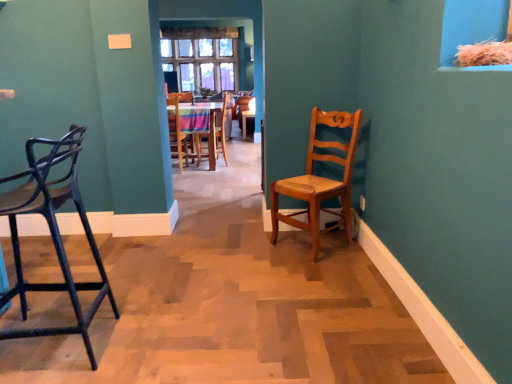
Question: Is the surface of light brown wooden chair at center, which is counted as the 2th chair, starting from the front, in direct contact with wooden chair at center, the 4th chair from the front?

Choices:
 (A) no
 (B) yes

Answer: (A)

Question: From the image's perspective, is light brown wooden chair at center, which ranks as the fourth chair in back-to-front order, located beneath wooden chair at center, the 4th chair from the front?

Choices:
 (A) no
 (B) yes

Answer: (B)

Question: Is light brown wooden chair at center, which is counted as the 2th chair, starting from the front, bigger than wooden chair at center, the 4th chair from the front?

Choices:
 (A) yes
 (B) no

Answer: (B)

Question: From the image's perspective, would you say light brown wooden chair at center, which ranks as the fourth chair in back-to-front order, is positioned over wooden chair at center, which is counted as the second chair, starting from the back?

Choices:
 (A) no
 (B) yes

Answer: (A)

Question: From a real-world perspective, is light brown wooden chair at center, which ranks as the fourth chair in back-to-front order, physically below wooden chair at center, which is counted as the second chair, starting from the back?

Choices:
 (A) no
 (B) yes

Answer: (A)

Question: Is wooden chair at center, the first chair when ordered from back to front, in front of or behind light brown wooden chair at center, which ranks as the fourth chair in back-to-front order, in the image?

Choices:
 (A) behind
 (B) front

Answer: (A)

Question: From the image's perspective, is wooden chair at center, the fifth chair when ordered from front to back, positioned above or below light brown wooden chair at center, which is counted as the 2th chair, starting from the front?

Choices:
 (A) below
 (B) above

Answer: (B)

Question: Based on their positions, is wooden chair at center, the first chair when ordered from back to front, located to the left or right of light brown wooden chair at center, which is counted as the 2th chair, starting from the front?

Choices:
 (A) left
 (B) right

Answer: (A)

Question: Considering the positions of wooden chair at center, the first chair when ordered from back to front, and light brown wooden chair at center, which is counted as the 2th chair, starting from the front, in the image, is wooden chair at center, the first chair when ordered from back to front, taller or shorter than light brown wooden chair at center, which is counted as the 2th chair, starting from the front,?

Choices:
 (A) tall
 (B) short

Answer: (A)

Question: Is point click(176, 99) closer or farther from the camera than point click(73, 304)?

Choices:
 (A) farther
 (B) closer

Answer: (A)

Question: Would you say wooden chair at center, the 3th chair positioned from the front, is inside or outside matte black stool at left, which is counted as the first chair, starting from the front?

Choices:
 (A) inside
 (B) outside

Answer: (B)

Question: Is wooden chair at center, the 3th chair positioned from the front, wider or thinner than matte black stool at left, which is counted as the first chair, starting from the front?

Choices:
 (A) thin
 (B) wide

Answer: (A)

Question: From the image's perspective, relative to matte black stool at left, which is counted as the first chair, starting from the front, is wooden chair at center, the 3th chair positioned from the front, above or below?

Choices:
 (A) above
 (B) below

Answer: (A)

Question: Is matte black stool at left, which is counted as the first chair, starting from the front, bigger or smaller than light brown wooden chair at center, which ranks as the fourth chair in back-to-front order?

Choices:
 (A) big
 (B) small

Answer: (A)

Question: In terms of width, does matte black stool at left, the 5th chair viewed from the back, look wider or thinner when compared to light brown wooden chair at center, which ranks as the fourth chair in back-to-front order?

Choices:
 (A) thin
 (B) wide

Answer: (B)